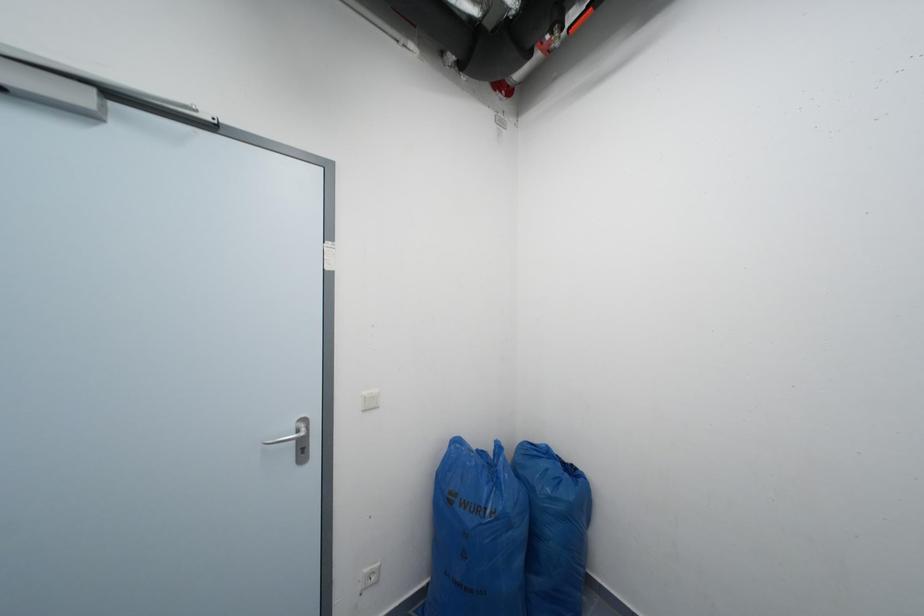
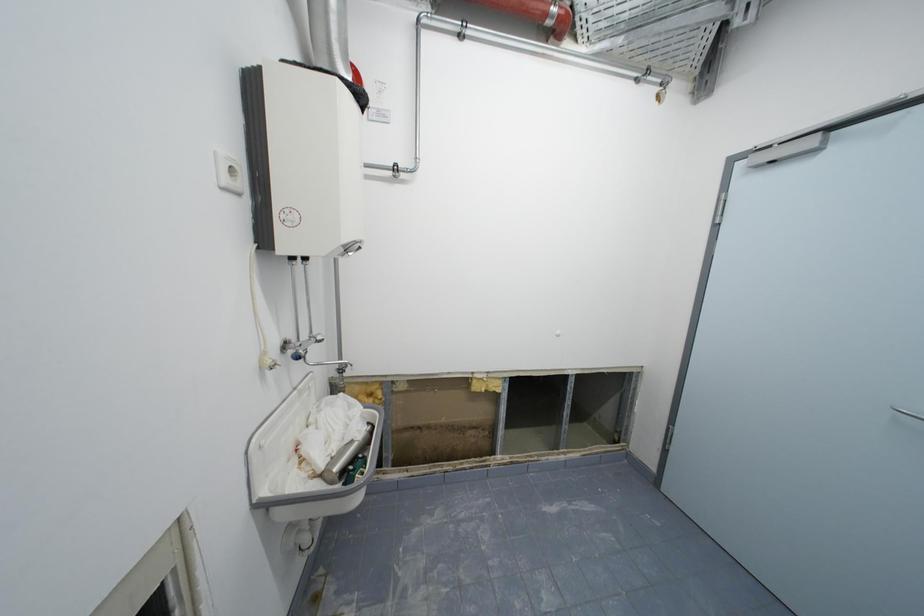
Question: The camera is either moving clockwise (left) or counter-clockwise (right) around the object. The first image is from the beginning of the video and the second image is from the end. Is the camera moving left or right when shooting the video?

Choices:
 (A) Left
 (B) Right

Answer: (B)